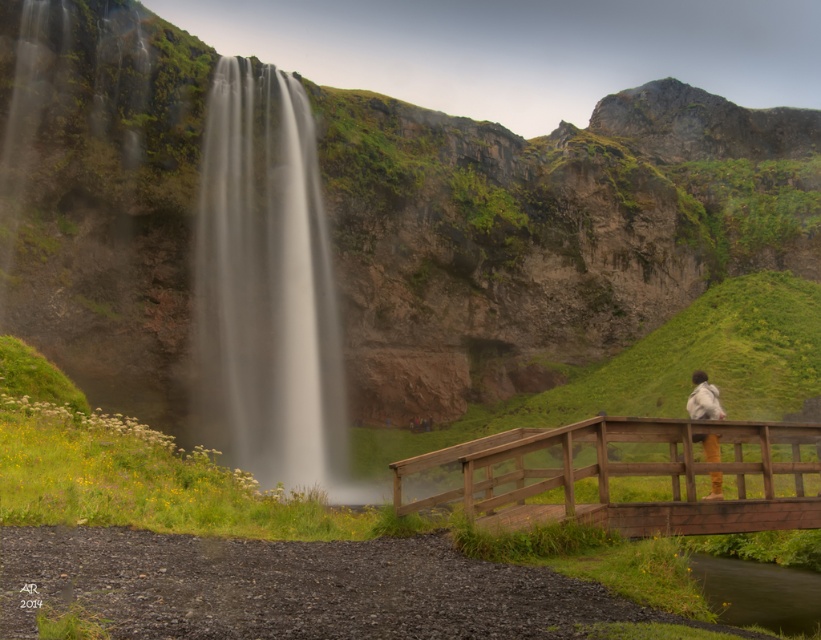
You are planning to take a photo of the white smooth waterfall at left and the wooden bridge at center. Which object should you focus on first if you want to capture both in a single frame, considering their sizes?

The white smooth waterfall at left has a larger size compared to the wooden bridge at center, so you should focus on the white smooth waterfall at left first to ensure it is properly framed before adjusting for the wooden bridge at center.

You are planning to cross the wooden bridge at center while carrying a large backpack. There is a person wearing a light gray fabric jacket at upper right on the bridge. Can you safely pass them on the bridge?

The wooden bridge at center might be wider than light gray fabric jacket at upper right, so it is possible that there is enough space to safely pass the person on the bridge.

You are a photographer planning to take a picture of the white smooth waterfall at left and the light gray fabric jacket at upper right. Based on their sizes, which object should you focus on first to ensure both are in frame?

The white smooth waterfall at left is larger in size than the light gray fabric jacket at upper right, so you should focus on the white smooth waterfall at left first to ensure both fit in the frame.